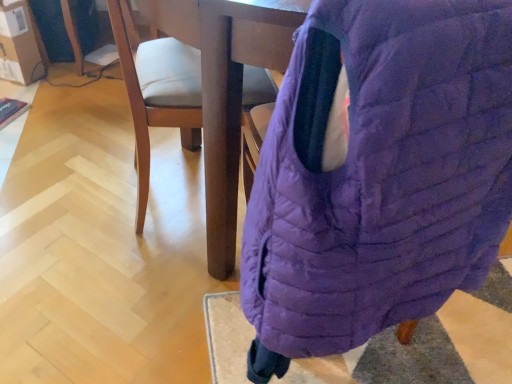
Locate an element on the screen. The height and width of the screenshot is (384, 512). vacant region to the left of light brown wood chair at center is located at coordinates (79, 185).